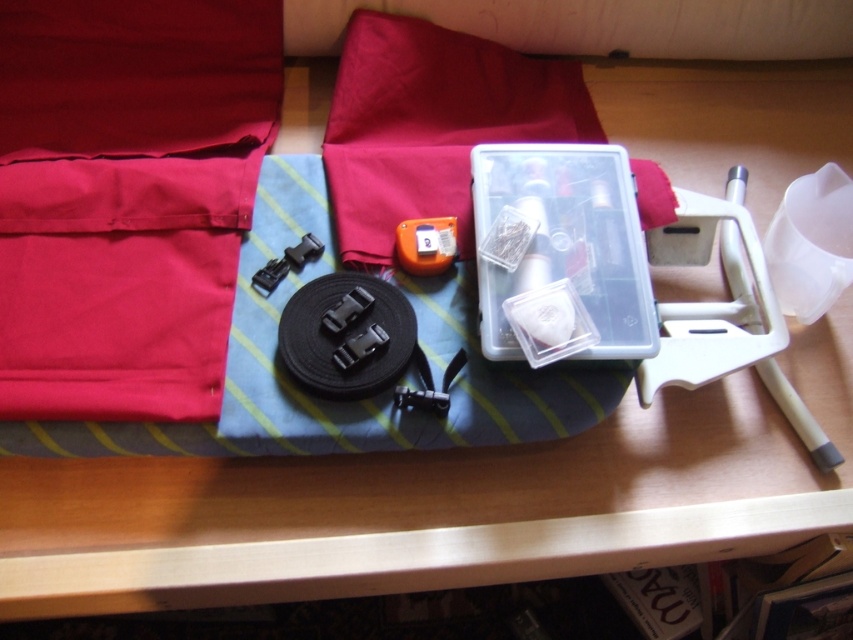
Question: Is clear plastic container at center to the right of orange matte tape measure at center from the viewer's perspective?

Choices:
 (A) no
 (B) yes

Answer: (B)

Question: Is clear plastic container at center above white plastic stand at right?

Choices:
 (A) no
 (B) yes

Answer: (B)

Question: Which of the following is the farthest from the observer?

Choices:
 (A) clear plastic container at center
 (B) orange matte tape measure at center
 (C) white plastic stand at right

Answer: (B)

Question: Estimate the real-world distances between objects in this image. Which object is closer to the orange matte tape measure at center?

Choices:
 (A) clear plastic container at center
 (B) white plastic stand at right

Answer: (A)

Question: Among these points, which one is farthest from the camera?

Choices:
 (A) tap(486, 340)
 (B) tap(688, 189)
 (C) tap(445, 227)

Answer: (B)

Question: Is clear plastic container at center below orange matte tape measure at center?

Choices:
 (A) no
 (B) yes

Answer: (B)